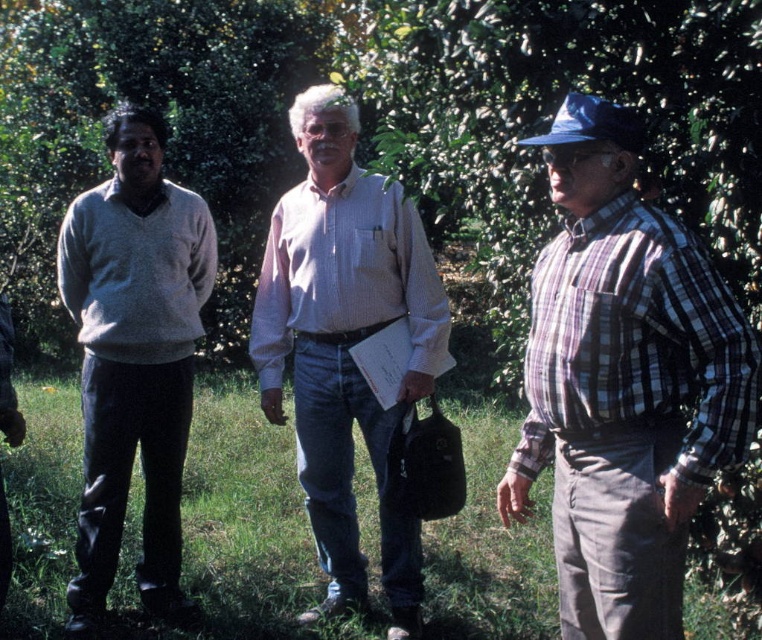
Measure the distance between plaid cotton shirt at right and green leafy tree at center.

plaid cotton shirt at right and green leafy tree at center are 6.83 meters apart.

Based on the photo, can you confirm if plaid cotton shirt at right is positioned to the right of green leafy tree at center?

Correct, you'll find plaid cotton shirt at right to the right of green leafy tree at center.

Identify the location of plaid cotton shirt at right. (623, 384).

Where is `plaid cotton shirt at right`? This screenshot has width=762, height=640. plaid cotton shirt at right is located at coordinates (623, 384).

Which is behind, point (335, 444) or point (186, 211)?

Point (186, 211)

Which is above, pink striped shirt at center or matte gray sweater at left?

Positioned higher is pink striped shirt at center.

Where is `pink striped shirt at center`? This screenshot has width=762, height=640. pink striped shirt at center is located at coordinates tap(346, 344).

Is point (165, 19) positioned before point (255, 348)?

No, it is behind (255, 348).

The width and height of the screenshot is (762, 640). In order to click on green leafy tree at center in this screenshot , I will do `click(167, 124)`.

At what (x,y) coordinates should I click in order to perform the action: click on green leafy tree at center. Please return your answer as a coordinate pair (x, y). The image size is (762, 640). Looking at the image, I should click on (167, 124).